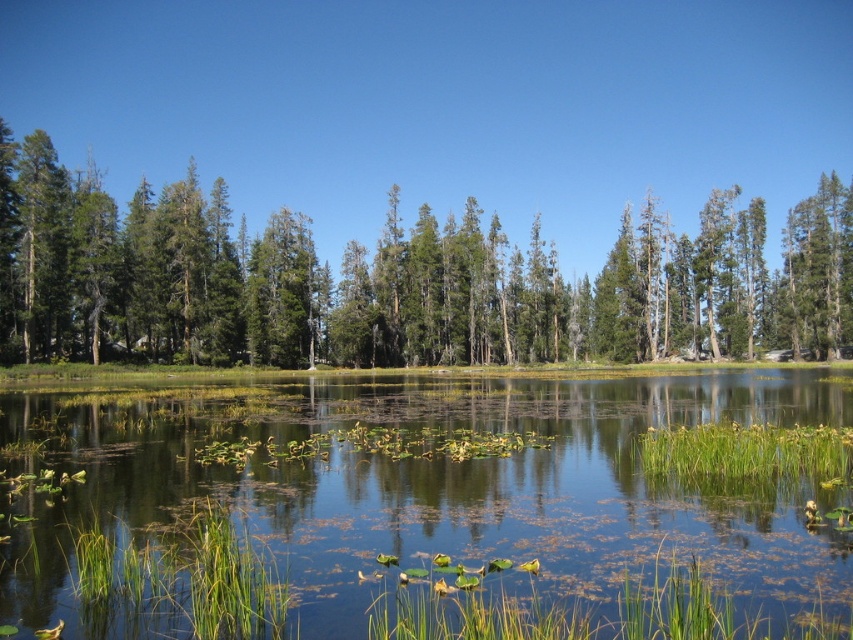
Does green grassy lake at center have a lesser width compared to green matte trees at center?

Correct, green grassy lake at center's width is less than green matte trees at center's.

Is point (202, 557) positioned behind point (654, 259)?

That is False.

You are a GUI agent. You are given a task and a screenshot of the screen. Output one action in this format:
    pyautogui.click(x=<x>, y=<y>)
    Task: Click on the green grassy lake at center
    The height and width of the screenshot is (640, 853).
    Given the screenshot: What is the action you would take?
    pyautogui.click(x=426, y=508)